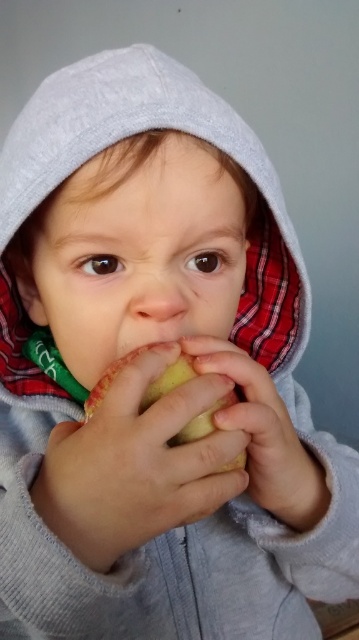
You are a fashion designer observing the image. You need to decide which item is taller between the gray cotton hoodie at center and the yellow matte apple at center. Which one is taller?

The gray cotton hoodie at center is taller than the yellow matte apple at center according to the description.

You are standing 10 inches away from the point at coordinates point (14, 225). Can you reach it without moving your feet?

The distance of point (14, 225) from viewer is 13.86 inches, so you are currently 10 inches away from it. Since 10 inches is less than 13.86 inches, you can reach it without moving your feet.

You are a nutritionist trying to assess the child in the image. The gray cotton hoodie at center and yellow matte apple at center are both in focus. Can you determine if the apple is within a safe distance for the child to eat without the hoodie obstructing their view?

The distance between the gray cotton hoodie at center and the yellow matte apple at center is 5.62 inches. Since the hoodie is up and partially covering the child, the apple is within a safe distance for the child to eat without obstruction.